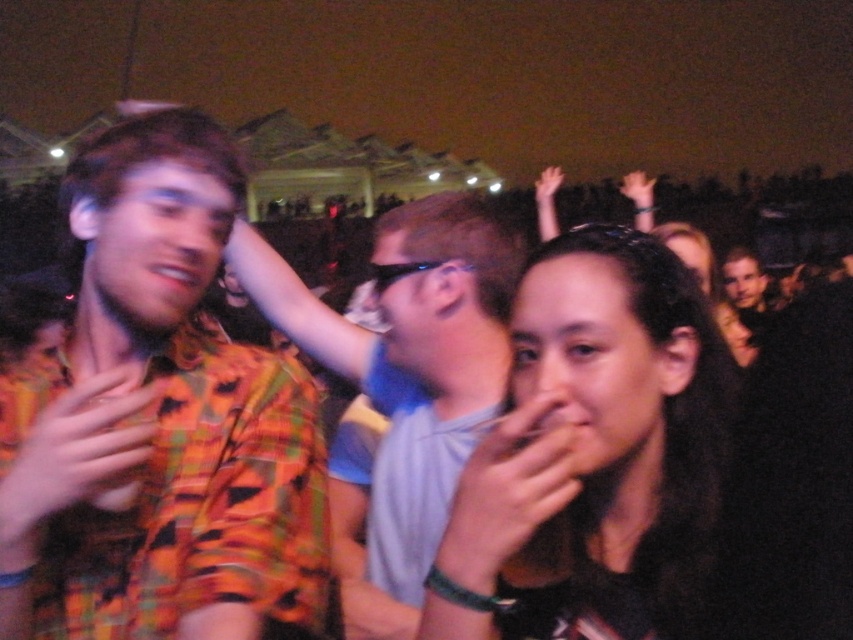
You are a photographer at the concert trying to capture the crowd. You notice the smooth skin hand at center. Where is this hand positioned relative to the other people in the scene?

The smooth skin hand at center is located at point 0.770 on the x axis and 0.597 on the y axis, which places it centrally in the frame, likely above the crowd.